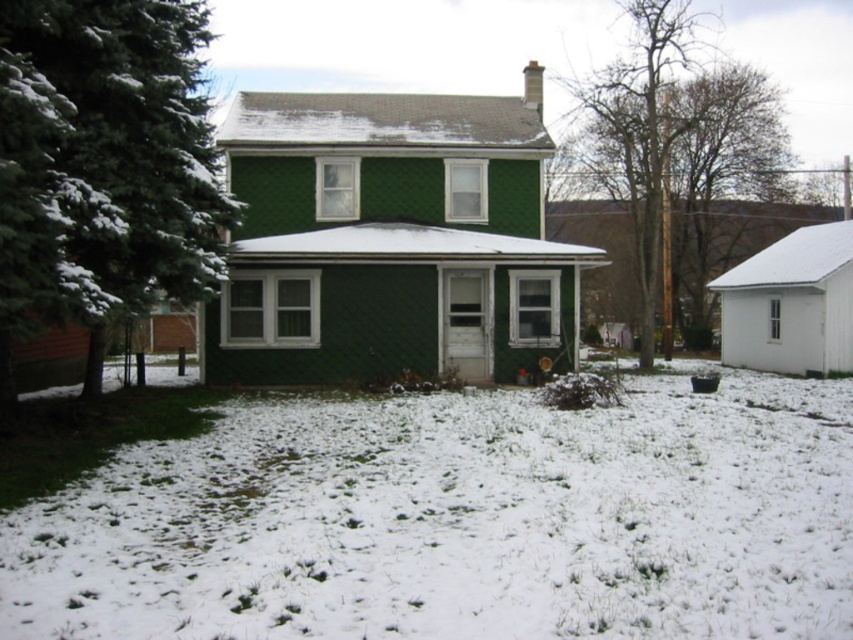
Question: Can you confirm if white fluffy snow at center is positioned to the right of bare wood pole at upper right?

Choices:
 (A) no
 (B) yes

Answer: (A)

Question: Is white fluffy snow at center closer to camera compared to green textured evergreen tree at left?

Choices:
 (A) no
 (B) yes

Answer: (B)

Question: Which point is closer to the camera taking this photo?

Choices:
 (A) (634, 452)
 (B) (1, 348)

Answer: (A)

Question: Is white fluffy snow at center further to camera compared to green textured evergreen tree at left?

Choices:
 (A) yes
 (B) no

Answer: (B)

Question: Which object is the farthest from the white fluffy snow at center?

Choices:
 (A) green textured evergreen tree at left
 (B) bare wood pole at upper right

Answer: (B)

Question: Estimate the real-world distances between objects in this image. Which object is closer to the green textured evergreen tree at left?

Choices:
 (A) bare wood pole at upper right
 (B) white fluffy snow at center

Answer: (B)